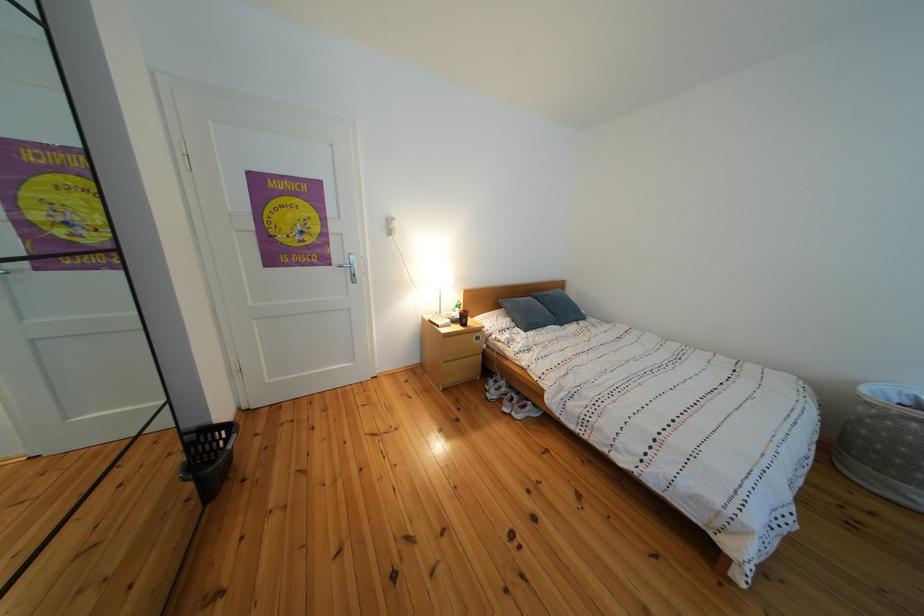
Describe the element at coordinates (391, 225) in the screenshot. I see `a white wall switch` at that location.